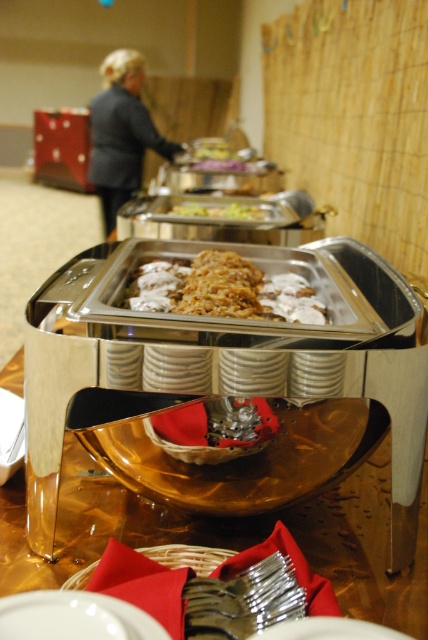
Question: Which point is closer to the camera taking this photo?

Choices:
 (A) (232, 580)
 (B) (160, 628)
 (C) (184, 310)
 (D) (196, 205)

Answer: (B)

Question: Which point is closer to the camera?

Choices:
 (A) (281, 627)
 (B) (137, 627)

Answer: (B)

Question: Does white glossy plate at center appear over green leafy vegetables at center?

Choices:
 (A) yes
 (B) no

Answer: (B)

Question: Is the position of white glossy plate at center more distant than that of green leafy vegetables at center?

Choices:
 (A) no
 (B) yes

Answer: (A)

Question: Considering the relative positions of gold metallic platter at center and white glossy plate at center in the image provided, where is gold metallic platter at center located with respect to white glossy plate at center?

Choices:
 (A) left
 (B) right

Answer: (A)

Question: Which point is closer to the camera?

Choices:
 (A) (273, 634)
 (B) (222, 208)
 (C) (115, 609)
 (D) (137, 77)

Answer: (A)